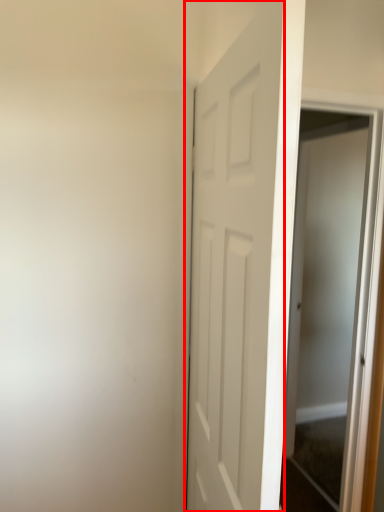
Question: From the image's perspective, what is the correct spatial positioning of door (annotated by the red box) in reference to screen door?

Choices:
 (A) above
 (B) below

Answer: (A)